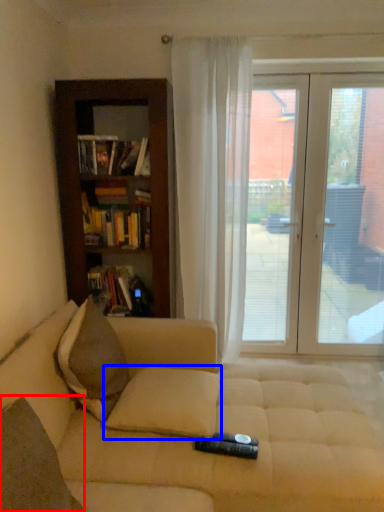
Question: Which point is further to the camera, pillow (highlighted by a red box) or pillow (highlighted by a blue box)?

Choices:
 (A) pillow
 (B) pillow

Answer: (B)